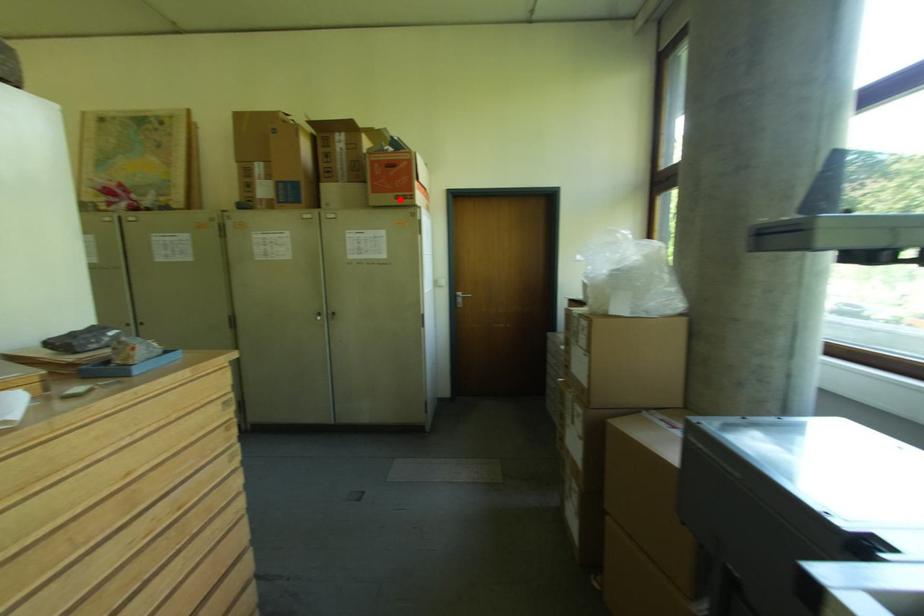
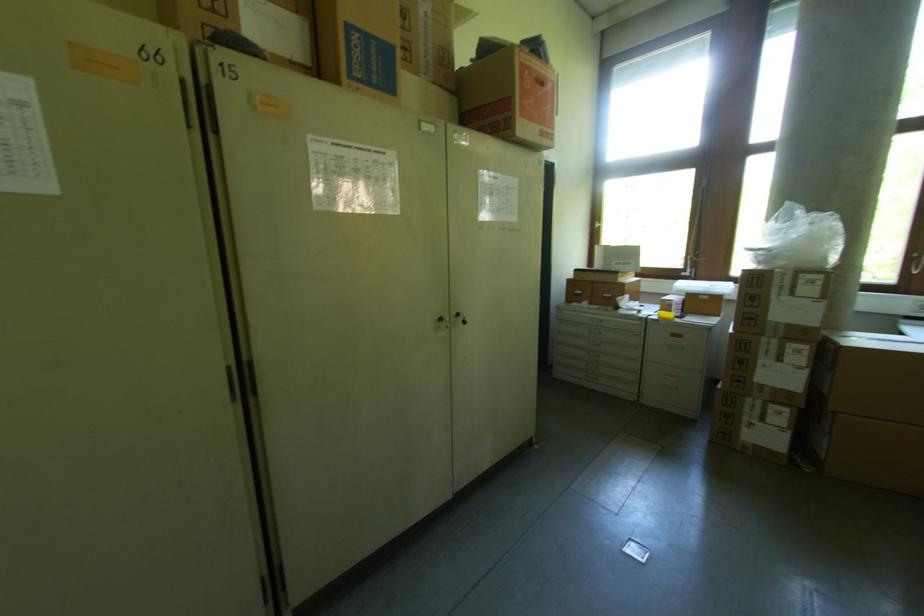
Find the pixel in the second image that matches the highlighted location in the first image.

(543, 136)